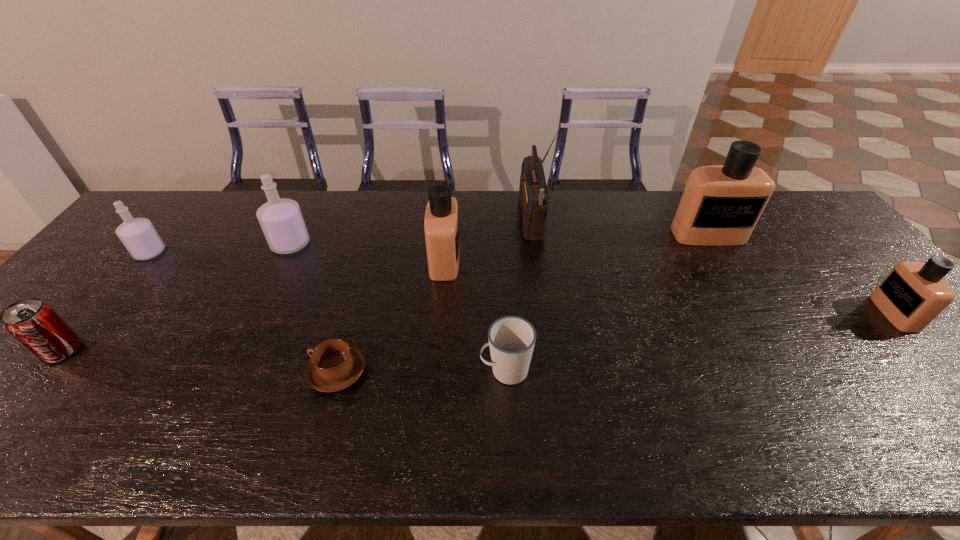
The width and height of the screenshot is (960, 540). Find the location of `vacant position located 0.070m with a handle on the side of the cup`. vacant position located 0.070m with a handle on the side of the cup is located at coordinates (449, 370).

This screenshot has width=960, height=540. I want to click on blank space located on the side of the fourth object from left to right with the handle, so click(256, 372).

Identify the location of free space located on the side of the fourth object from left to right with the handle. This screenshot has height=540, width=960. (144, 372).

Where is `blank area located on the side of the fourth object from left to right with the handle`? blank area located on the side of the fourth object from left to right with the handle is located at coordinates (230, 372).

I want to click on radio receiver positioned at the far edge, so click(x=534, y=199).

This screenshot has width=960, height=540. I want to click on perfume that is at the left edge, so click(138, 235).

This screenshot has height=540, width=960. Identify the location of pop soda that is at the left edge. (35, 325).

At what (x,y) coordinates should I click in order to perform the action: click on object that is at the right edge. Please return your answer as a coordinate pair (x, y). This screenshot has height=540, width=960. Looking at the image, I should click on (913, 294).

Find the location of a particular element. vacant area at the far edge of the desktop is located at coordinates (498, 194).

In the image, there is a desktop. Where is `vacant area at the near edge`? The image size is (960, 540). vacant area at the near edge is located at coordinates (554, 445).